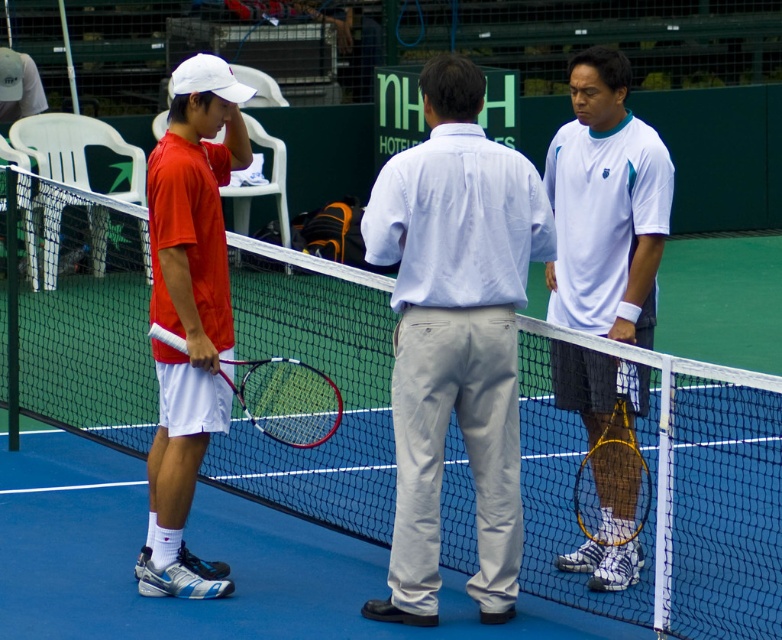
You are a photographer positioned behind the central figure. You want to capture a photo where both the white mesh tennis net at center and the wooden tennis racket at right are visible in the frame. Which object should you focus on first to ensure both are in focus?

The white mesh tennis net at center is taller than the wooden tennis racket at right, so you should focus on the white mesh tennis net at center first to ensure both are in focus.

You are a tennis coach observing the scene. You notice two tennis rackets at the right side of the central figure. Which racket is closer to the central figure? The white matte tennis racket at right or the wooden tennis racket at right?

The white matte tennis racket at right is positioned on the left side of wooden tennis racket at right, so the white matte tennis racket at right is closer to the central figure.